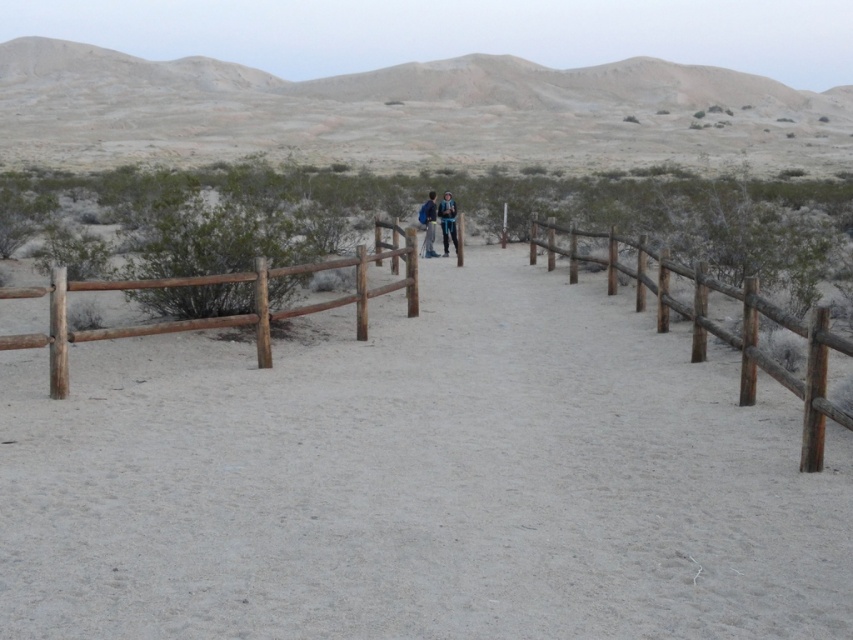
Question: Is brown wooden fence at left positioned behind blue fabric backpack at center?

Choices:
 (A) no
 (B) yes

Answer: (A)

Question: Does blue fabric backpack at center come behind blue denim jacket at center?

Choices:
 (A) yes
 (B) no

Answer: (B)

Question: Which point is closer to the camera?

Choices:
 (A) (442, 230)
 (B) (515, 493)
 (C) (430, 189)
 (D) (238, 81)

Answer: (B)

Question: Does desert at upper center come in front of blue denim jacket at center?

Choices:
 (A) yes
 (B) no

Answer: (B)

Question: Which point appears closest to the camera in this image?

Choices:
 (A) (428, 250)
 (B) (819, 410)
 (C) (444, 220)

Answer: (B)

Question: Estimate the real-world distances between objects in this image. Which object is farther from the desert at upper center?

Choices:
 (A) blue denim jacket at center
 (B) brown wooden fence at center

Answer: (B)